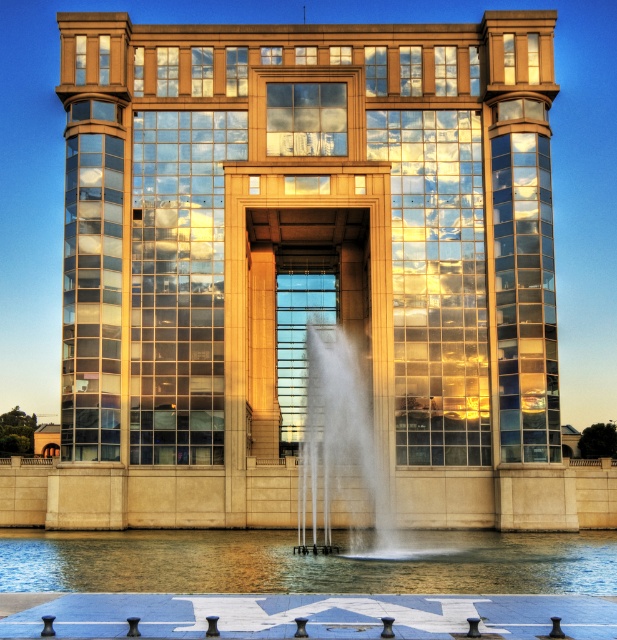
Question: Can you confirm if clear glass water at lower center is bigger than white frothy water at center?

Choices:
 (A) no
 (B) yes

Answer: (B)

Question: Is clear glass water at lower center to the left of white frothy water at center from the viewer's perspective?

Choices:
 (A) no
 (B) yes

Answer: (A)

Question: Is the position of clear glass water at lower center more distant than that of white frothy water at center?

Choices:
 (A) yes
 (B) no

Answer: (B)

Question: Which point is farther to the camera?

Choices:
 (A) (307, 576)
 (B) (370, 440)

Answer: (B)

Question: Among these points, which one is farthest from the camera?

Choices:
 (A) (569, 556)
 (B) (304, 426)

Answer: (B)

Question: Which point is farther to the camera?

Choices:
 (A) clear glass water at lower center
 (B) white frothy water at center

Answer: (B)